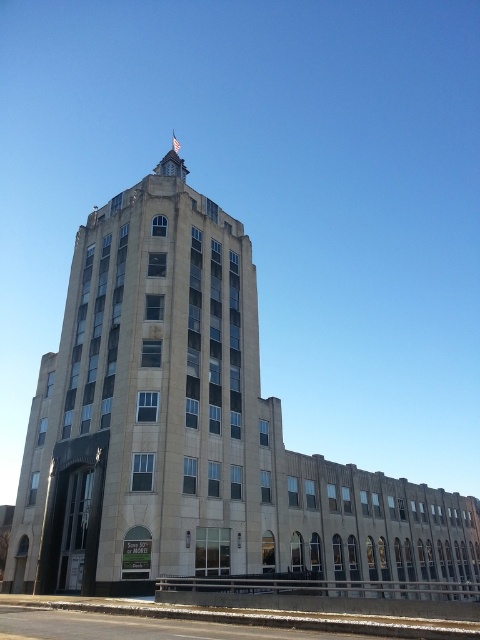
Who is more distant from viewer, (x=71, y=308) or (x=168, y=161)?

The point (x=168, y=161) is more distant.

Which of these two, beige stone tower at center or stained glass clock at upper center, stands shorter?

With less height is stained glass clock at upper center.

The height and width of the screenshot is (640, 480). Find the location of `beige stone tower at center`. beige stone tower at center is located at coordinates coord(152,406).